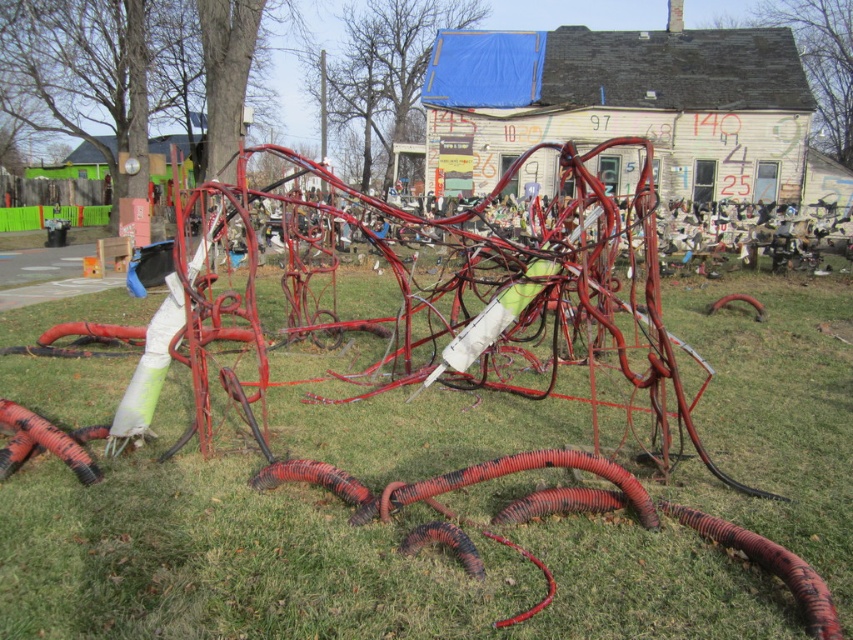
Question: Is green grass at center to the left of rubber hose at lower left from the viewer's perspective?

Choices:
 (A) no
 (B) yes

Answer: (A)

Question: Is green grass at center to the left of rubber hose at lower left from the viewer's perspective?

Choices:
 (A) no
 (B) yes

Answer: (A)

Question: Which point appears farthest from the camera in this image?

Choices:
 (A) (158, 554)
 (B) (25, 440)

Answer: (B)

Question: Does green grass at center appear under rubber hose at lower left?

Choices:
 (A) no
 (B) yes

Answer: (A)